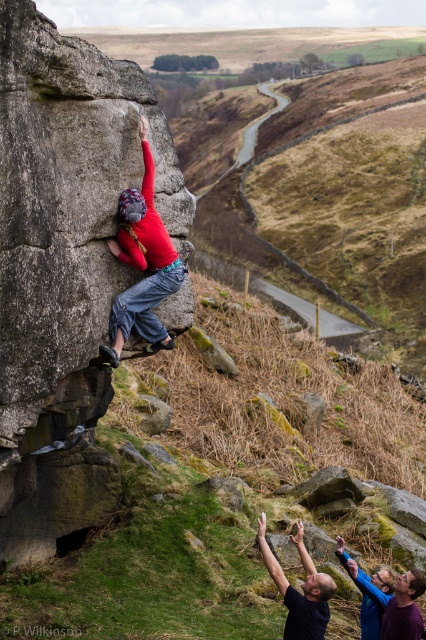
Question: Among these objects, which one is farthest from the camera?

Choices:
 (A) smooth gray rock at left
 (B) smooth skin man at center
 (C) matte red shirt at center

Answer: (C)

Question: Does smooth skin man at center appear under blue denim shirt at lower right?

Choices:
 (A) no
 (B) yes

Answer: (A)

Question: Considering the real-world distances, which object is closest to the smooth skin man at center?

Choices:
 (A) smooth gray rock at left
 (B) matte red shirt at center
 (C) blue denim shirt at lower right

Answer: (C)

Question: Which object is the farthest from the smooth gray rock at left?

Choices:
 (A) matte red shirt at center
 (B) smooth skin man at center
 (C) blue denim shirt at lower right

Answer: (C)

Question: Can you confirm if smooth skin man at center is thinner than blue denim shirt at lower right?

Choices:
 (A) no
 (B) yes

Answer: (A)

Question: Can you confirm if matte red shirt at center is positioned to the left of smooth skin man at center?

Choices:
 (A) no
 (B) yes

Answer: (B)